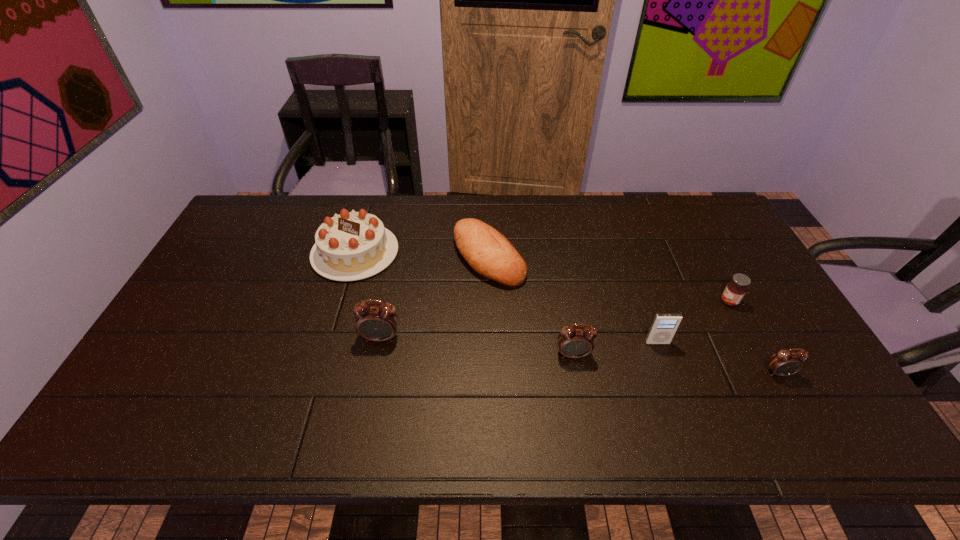
Locate an element on the screen. object that is at the near edge is located at coordinates (786, 362).

Locate an element on the screen. The height and width of the screenshot is (540, 960). alarm clock that is positioned at the right edge is located at coordinates (786, 362).

You are a GUI agent. You are given a task and a screenshot of the screen. Output one action in this format:
    pyautogui.click(x=<x>, y=<y>)
    Task: Click on the jam present at the right edge
    This screenshot has width=960, height=540.
    Given the screenshot: What is the action you would take?
    pyautogui.click(x=735, y=290)

Locate an element on the screen. The image size is (960, 540). object that is at the near right corner is located at coordinates (786, 362).

Where is `vacant space at the far edge`? vacant space at the far edge is located at coordinates (406, 224).

The image size is (960, 540). In order to click on vacant space at the near edge of the desktop in this screenshot , I will do `click(641, 394)`.

Locate an element on the screen. free point at the left edge is located at coordinates (209, 343).

Locate an element on the screen. blank space at the right edge of the desktop is located at coordinates (756, 339).

This screenshot has width=960, height=540. Find the location of `free space at the far left corner`. free space at the far left corner is located at coordinates (290, 195).

I want to click on vacant area at the far right corner, so click(684, 226).